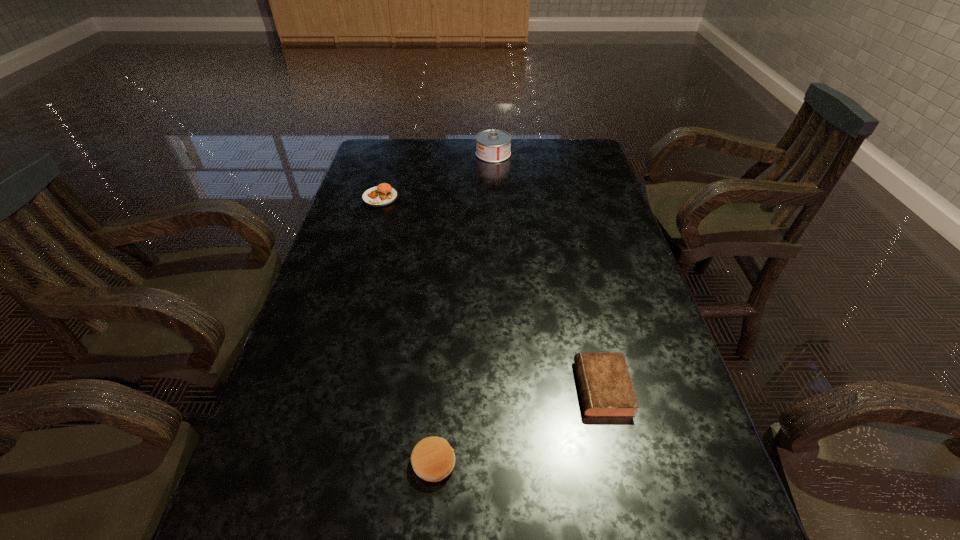
Where is `vacant space situated on the left of the nearest object`? vacant space situated on the left of the nearest object is located at coordinates (280, 463).

Find the location of a particular element. The height and width of the screenshot is (540, 960). free space located on the spine side of the diary is located at coordinates (506, 388).

What are the coordinates of `free region located on the spine side of the diary` in the screenshot? It's located at (443, 388).

Find the location of `vacant space located on the spine side of the diary`. vacant space located on the spine side of the diary is located at coordinates (535, 388).

Find the location of a particular element. The image size is (960, 540). object positioned at the far edge is located at coordinates (493, 146).

The image size is (960, 540). In order to click on object that is at the left edge in this screenshot , I will do `click(382, 195)`.

Where is `object at the right edge`? object at the right edge is located at coordinates (606, 389).

In the image, there is a desktop. Where is `vacant space at the left edge`? The height and width of the screenshot is (540, 960). vacant space at the left edge is located at coordinates (336, 261).

Where is `free spot at the right edge of the desktop`? The height and width of the screenshot is (540, 960). free spot at the right edge of the desktop is located at coordinates (571, 218).

This screenshot has height=540, width=960. In the image, there is a desktop. In order to click on vacant space at the far left corner in this screenshot , I will do `click(396, 157)`.